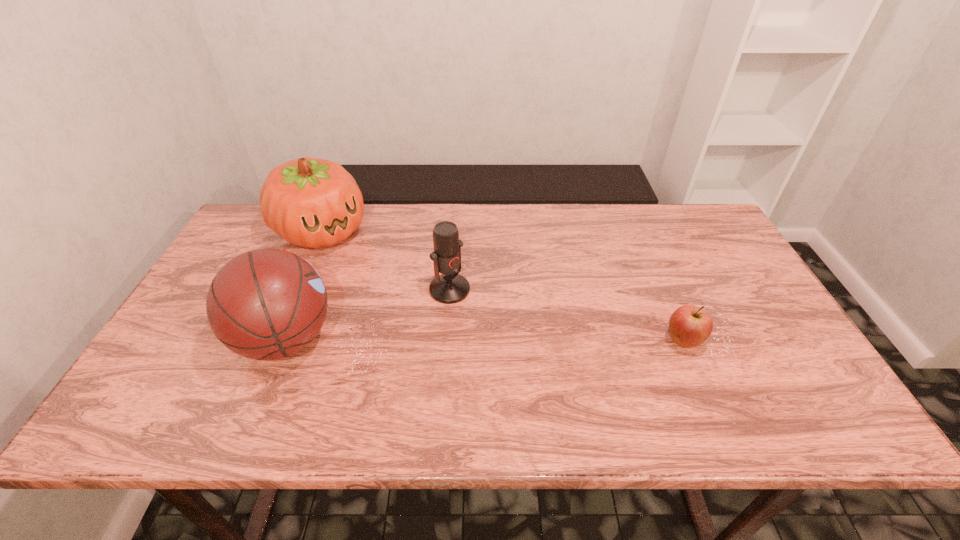
Identify the location of free space at the far edge of the desktop. The width and height of the screenshot is (960, 540). (396, 209).

In the image, there is a desktop. Where is `vacant space at the near edge`? vacant space at the near edge is located at coordinates (482, 386).

Identify the location of free space at the far left corner of the desktop. This screenshot has width=960, height=540. (247, 247).

This screenshot has height=540, width=960. I want to click on vacant space at the far right corner of the desktop, so click(x=684, y=205).

Find the location of a particular element. This screenshot has height=540, width=960. free space at the near right corner is located at coordinates (807, 390).

The height and width of the screenshot is (540, 960). In order to click on empty space between the apple and the third tallest object in this screenshot , I will do `click(566, 315)`.

I want to click on free spot between the basketball and the second shortest object, so click(368, 314).

Image resolution: width=960 pixels, height=540 pixels. I want to click on free space between the shortest object and the second shortest object, so click(x=566, y=315).

I want to click on vacant area that lies between the microphone and the basketball, so click(368, 314).

In order to click on free spot between the third tallest object and the apple in this screenshot , I will do `click(566, 315)`.